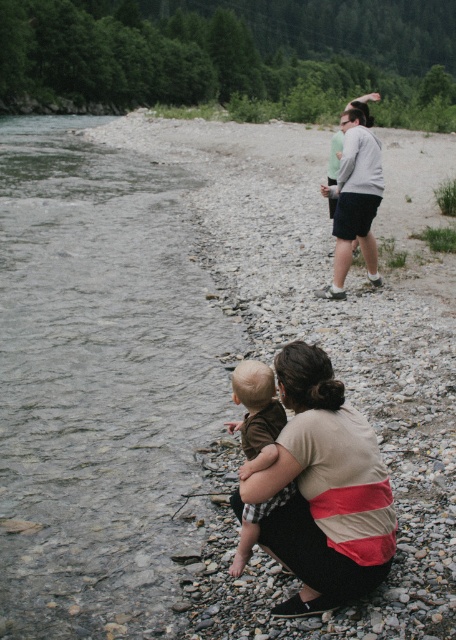
You are standing at the point with coordinates point (88, 380) and want to walk towards the point with coordinates point (347, 449). Which direction should you move in?

You should move away from the viewer because point (88, 380) is closer to the viewer than point (347, 449).

You are a photographer trying to capture the baby in focus while also including the clear water at stream left in the frame. Since the brown cotton shirt at lower center is blocking your view, where should you position yourself to ensure both are visible?

The brown cotton shirt at lower center is behind the clear water at stream left, so positioning yourself to the side or slightly behind the clear water at stream left will allow you to see both the baby and the clear water at stream left without obstruction.

You are a photographer trying to capture a family photo. You see the beige striped shirt at lower center and the brown cotton shirt at lower center. Which one should you focus on if you want to include both in the frame without cropping the right edge?

The beige striped shirt at lower center is positioned on the right side of the brown cotton shirt at lower center, so focusing on the beige striped shirt at lower center would ensure both are included without cropping the right edge.